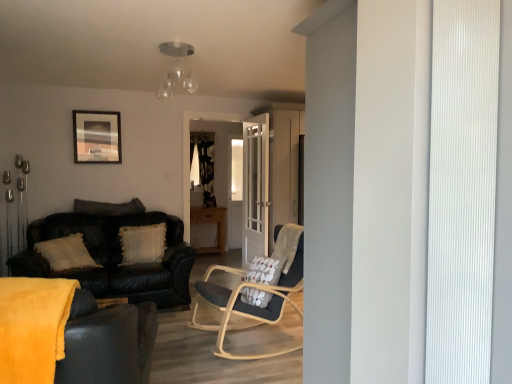
Question: Considering the positions of white glossy door at center and light brown wooden table at center in the image, is white glossy door at center taller or shorter than light brown wooden table at center?

Choices:
 (A) tall
 (B) short

Answer: (A)

Question: From the image's perspective, relative to light brown wooden table at center, is white glossy door at center above or below?

Choices:
 (A) above
 (B) below

Answer: (A)

Question: Estimate the real-world distances between objects in this image. Which object is closer to the leather couch at left, the second studio couch positioned from the front?

Choices:
 (A) velvet dark brown couch at left, the 2th studio couch from the back
 (B) white textured pillow at center, which is the 1th pillow in bottom-to-top order
 (C) wooden picture frame at upper left
 (D) wooden side table at lower left
 (E) light brown wooden table at center

Answer: (B)

Question: Considering the real-world distances, which object is closest to the velvet dark brown couch at left, the 2th studio couch from the back?

Choices:
 (A) white textured pillow at center, which is the 1th pillow in bottom-to-top order
 (B) white glossy door at center
 (C) light brown wooden table at center
 (D) leather couch at left, which is the 1th studio couch in back-to-front order
 (E) wooden side table at lower left

Answer: (E)